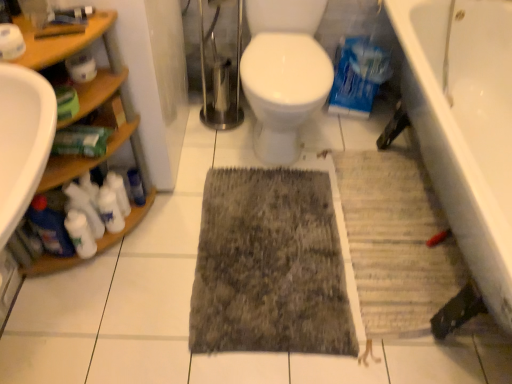
Where is `vacant area that lies between woodenshelves at left and gray textured bath mat at lower right`? vacant area that lies between woodenshelves at left and gray textured bath mat at lower right is located at coordinates click(x=247, y=246).